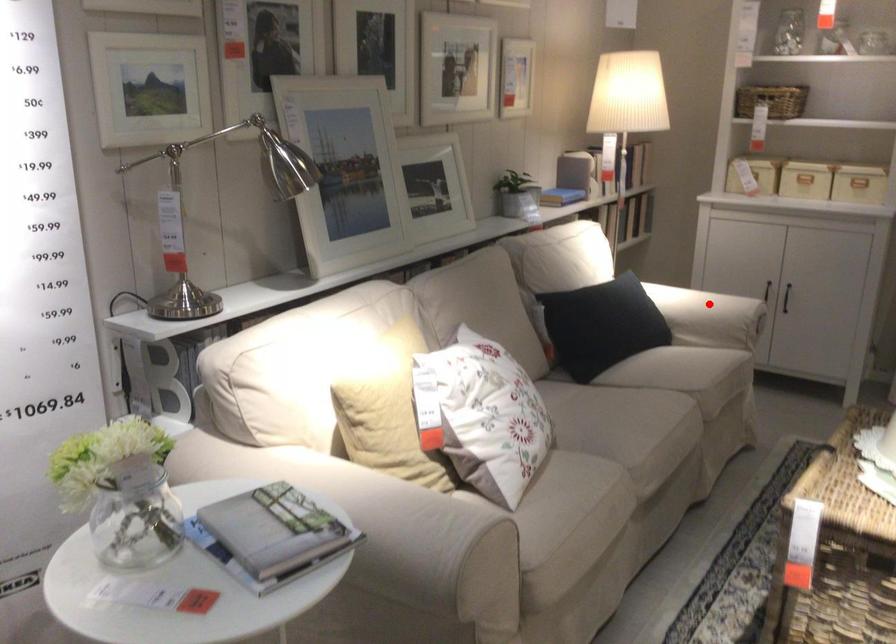
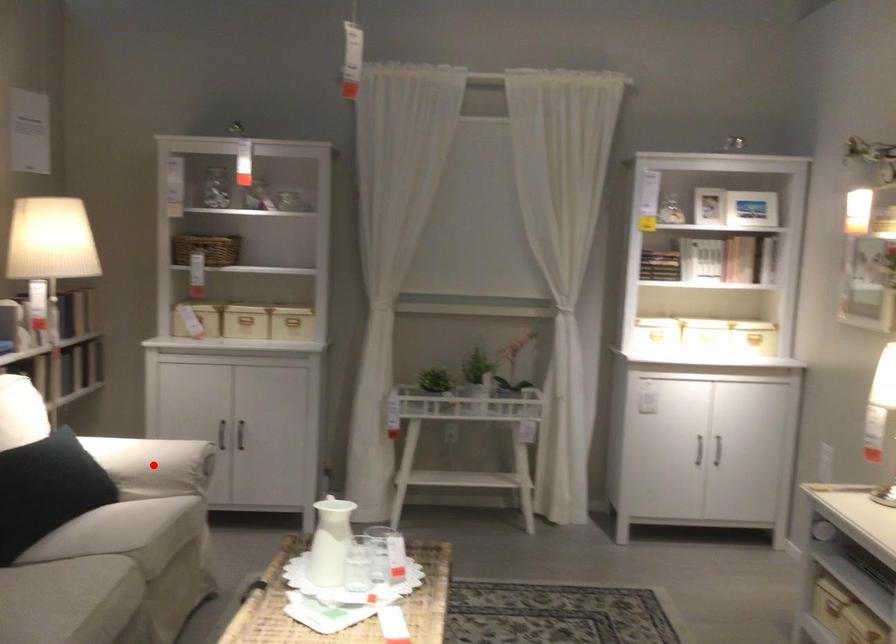
I am providing you with two images of the same scene from different viewpoints. A red point is marked on the first image and another point is marked on the second image. Does the point marked in image1 correspond to the same location as the one in image2?

Yes